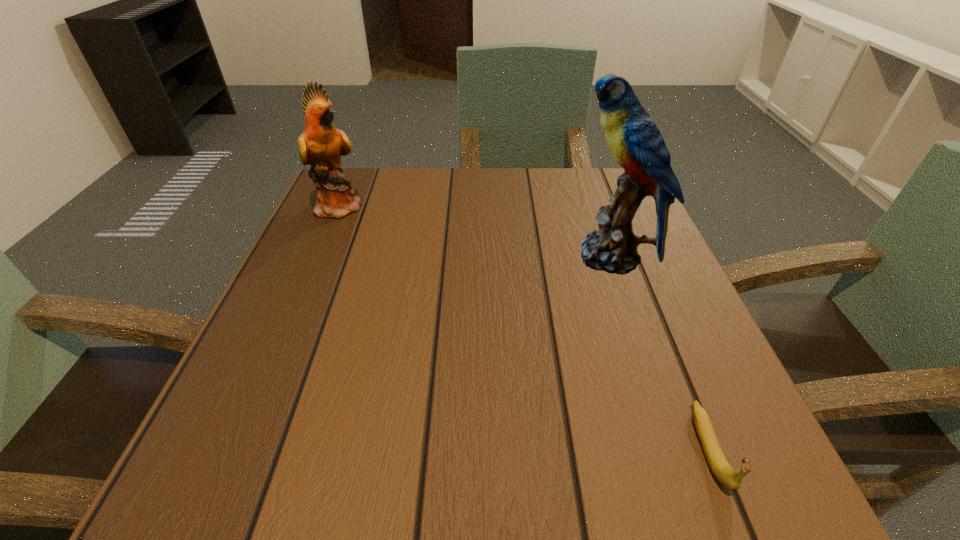
Locate an element on the screen. The image size is (960, 540). the right parrot is located at coordinates (636, 143).

At what (x,y) coordinates should I click in order to perform the action: click on the nearer parrot. Please return your answer as a coordinate pair (x, y). Looking at the image, I should click on (636, 143).

This screenshot has height=540, width=960. Find the location of `the leftmost object`. the leftmost object is located at coordinates (x=321, y=145).

Locate an element on the screen. This screenshot has width=960, height=540. the left parrot is located at coordinates (321, 145).

Where is `the nearest object`? the nearest object is located at coordinates (720, 467).

This screenshot has height=540, width=960. What are the coordinates of `the shortest object` in the screenshot? It's located at (720, 467).

I want to click on vacant point located on the face of the tallest object, so click(492, 256).

You are a GUI agent. You are given a task and a screenshot of the screen. Output one action in this format:
    pyautogui.click(x=<x>, y=<y>)
    Task: Click on the vacant space located 0.220m on the face of the tallest object
    The width and height of the screenshot is (960, 540).
    Given the screenshot: What is the action you would take?
    pyautogui.click(x=456, y=256)

Image resolution: width=960 pixels, height=540 pixels. In order to click on blank space located on the face of the tallest object in this screenshot , I will do `click(481, 256)`.

Find the location of a particular element. free space located on the front-facing side of the farther parrot is located at coordinates (543, 206).